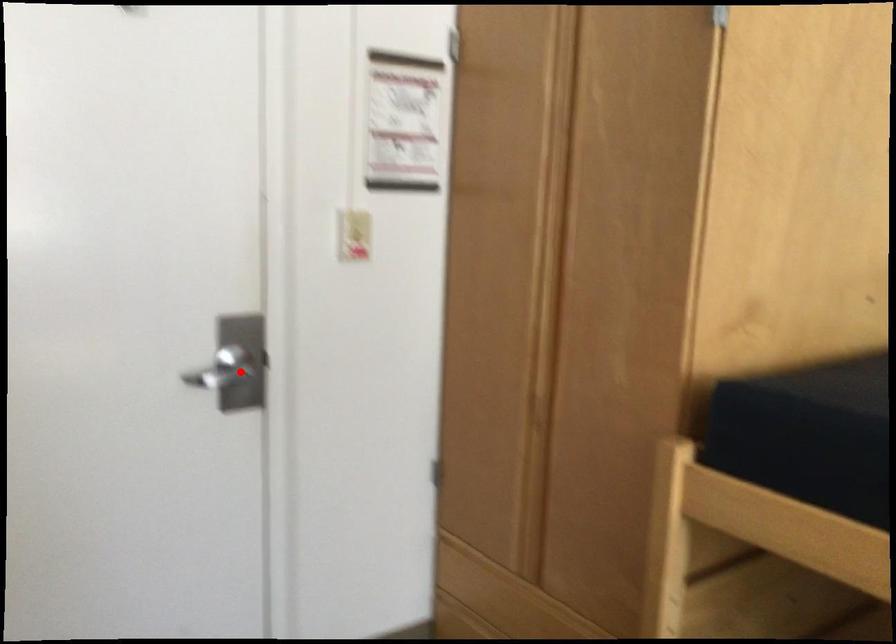
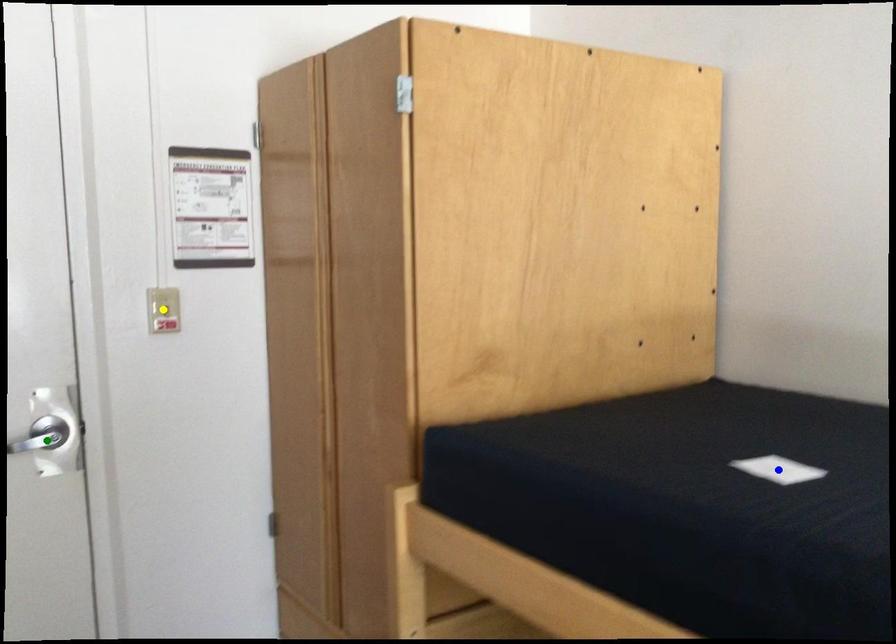
Question: I am providing you with two images of the same scene from different viewpoints. A red point is marked on the first image. You are given multiple points on the second image. Which point in image 2 represents the same 3d spot as the red point in image 1?

Choices:
 (A) yellow point
 (B) blue point
 (C) green point

Answer: (C)